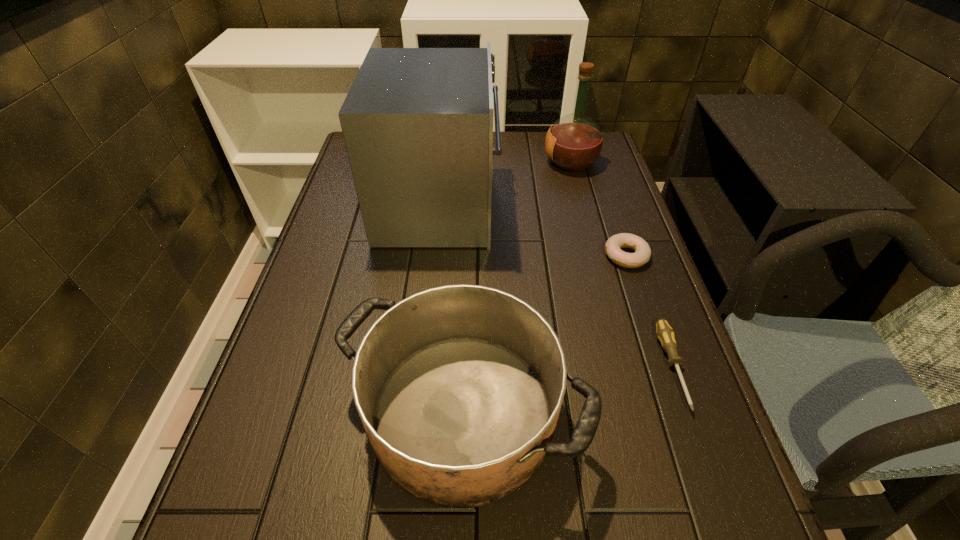
Where is `the tallest object`? the tallest object is located at coordinates (417, 123).

What are the coordinates of `the fourth shortest object` in the screenshot? It's located at (574, 142).

The height and width of the screenshot is (540, 960). What are the coordinates of `saucepan` in the screenshot? It's located at (459, 388).

Identify the location of doughnut. (642, 250).

Where is `screwdriver`? The height and width of the screenshot is (540, 960). screwdriver is located at coordinates (665, 334).

Find the location of a particular element. The height and width of the screenshot is (540, 960). free space located 0.140m on the front panel of the tallest object is located at coordinates (546, 205).

Where is `free space located 0.350m on the front label of the second tallest object`? The image size is (960, 540). free space located 0.350m on the front label of the second tallest object is located at coordinates (433, 163).

This screenshot has width=960, height=540. What are the coordinates of `vacant space positioned on the front label of the second tallest object` in the screenshot? It's located at (443, 163).

At what (x,y) coordinates should I click in order to perform the action: click on free spot located on the front label of the second tallest object. Please return your answer as a coordinate pair (x, y). Image resolution: width=960 pixels, height=540 pixels. Looking at the image, I should click on (430, 163).

Locate an element on the screen. vacant space located 0.190m on the back of the saucepan is located at coordinates (467, 273).